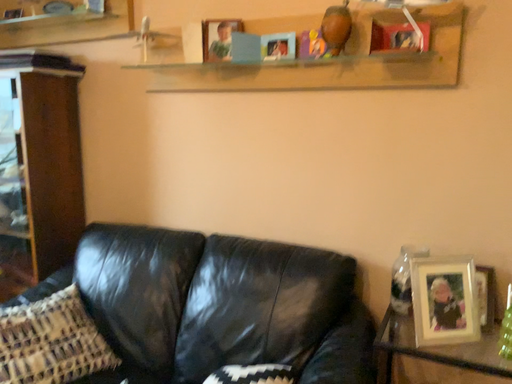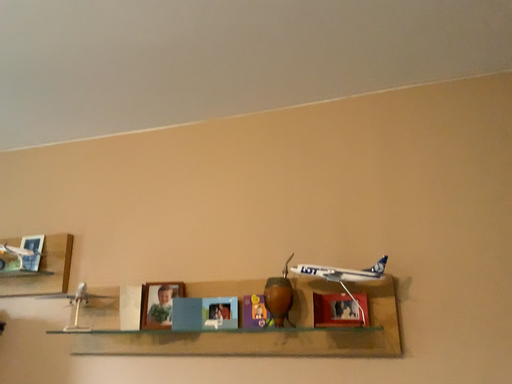
Question: Which way did the camera rotate in the video?

Choices:
 (A) rotated right
 (B) rotated left

Answer: (A)